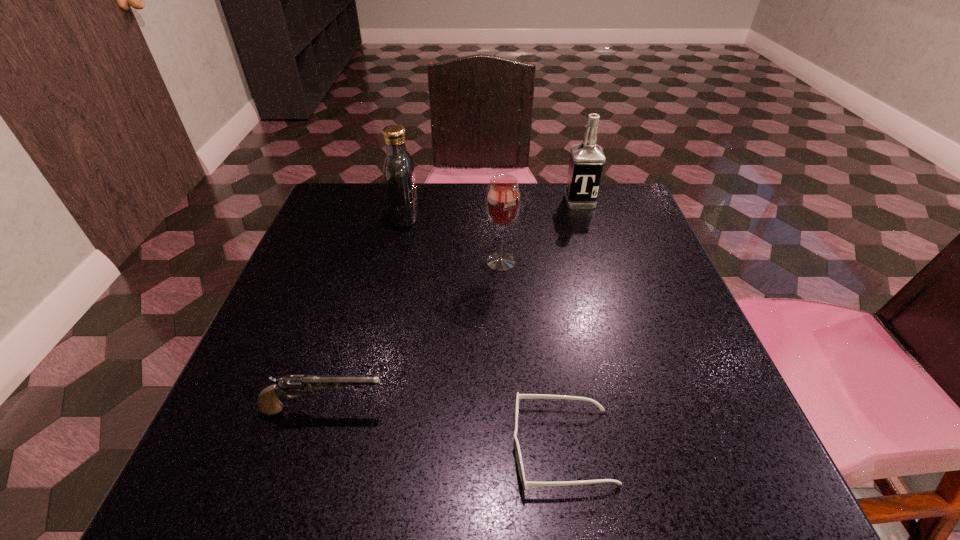
The height and width of the screenshot is (540, 960). Find the location of `the left vodka`. the left vodka is located at coordinates coord(399,175).

At what (x,y) coordinates should I click in order to perform the action: click on the rightmost object. Please return your answer as a coordinate pair (x, y). The height and width of the screenshot is (540, 960). Looking at the image, I should click on (586, 163).

Identify the location of wineglass. This screenshot has height=540, width=960. (503, 199).

You are a GUI agent. You are given a task and a screenshot of the screen. Output one action in this format:
    pyautogui.click(x=<x>, y=<y>)
    Task: Click on the fourth tallest object
    
    Given the screenshot: What is the action you would take?
    pyautogui.click(x=268, y=403)

The width and height of the screenshot is (960, 540). Identify the location of sunglasses. (524, 483).

The image size is (960, 540). What are the coordinates of `free space located 0.370m on the front-facing side of the left vodka` in the screenshot? It's located at (566, 217).

At what (x,y) coordinates should I click in order to perform the action: click on vacant area located on the front label of the right vodka. Please return your answer as a coordinate pair (x, y). Looking at the image, I should click on (601, 271).

The image size is (960, 540). In order to click on vacant space situated 0.200m on the right of the wineglass in this screenshot , I will do `click(609, 262)`.

The image size is (960, 540). Identify the location of free space located aiming along the barrel of the second shortest object. (493, 409).

This screenshot has height=540, width=960. Identify the location of vacant space located with the lenses of the sunglasses facing outward. (271, 447).